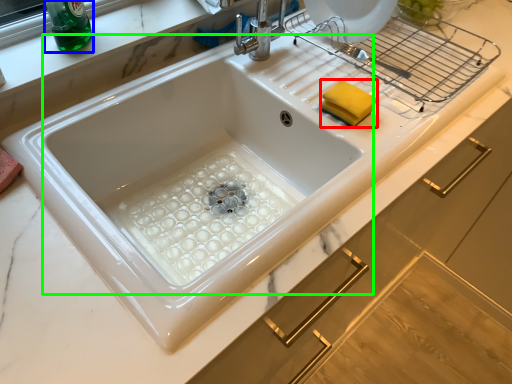
Question: Which object is positioned closest to food (highlighted by a red box)? Select from beverage (highlighted by a blue box) and sink (highlighted by a green box).

Choices:
 (A) beverage
 (B) sink

Answer: (B)